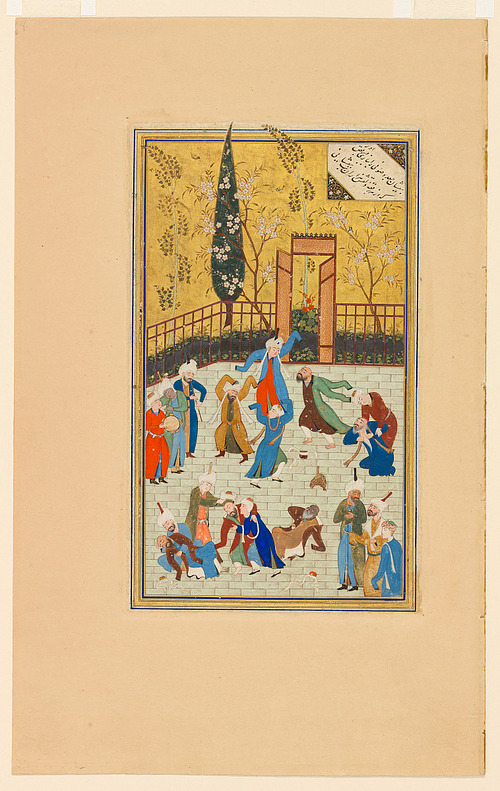
Find the location of a particular element. doors is located at coordinates (328, 286), (287, 290).